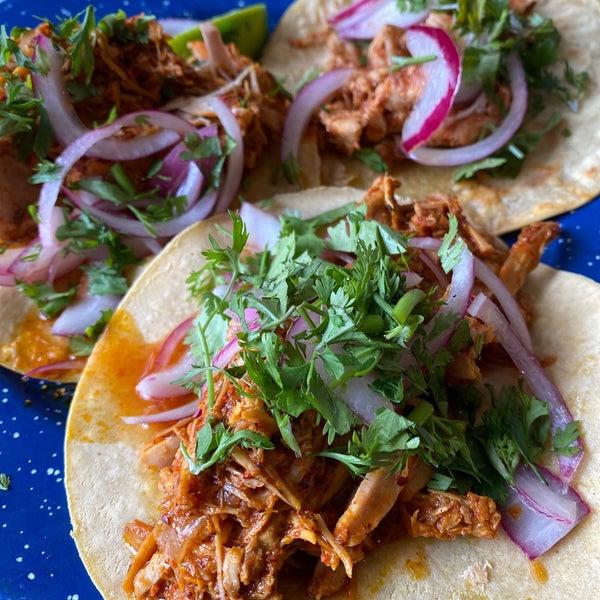
Locate an element on the screen. Image resolution: width=600 pixels, height=600 pixels. white spots/ markings on tablecloth is located at coordinates (49, 470).